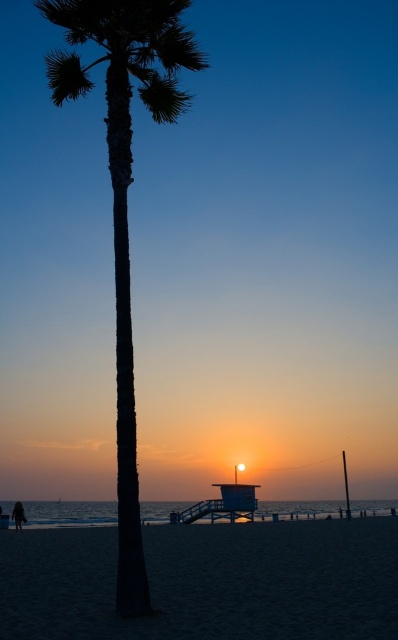
Question: Does sandy beach at lower center have a smaller size compared to dark skin person at lower left?

Choices:
 (A) no
 (B) yes

Answer: (A)

Question: Which point appears closest to the camera in this image?

Choices:
 (A) pos(19,508)
 (B) pos(70,83)

Answer: (B)

Question: Does sandy beach at lower center have a lesser width compared to dark green textured palm tree at center?

Choices:
 (A) yes
 (B) no

Answer: (B)

Question: Which of these objects is positioned farthest from the dark green textured palm tree at center?

Choices:
 (A) dark skin person at lower left
 (B) sandy beach at lower center

Answer: (A)

Question: Which of the following is the farthest from the observer?

Choices:
 (A) (312, 593)
 (B) (21, 502)
 (C) (64, 10)

Answer: (B)

Question: Does dark green textured palm tree at center have a smaller size compared to dark skin person at lower left?

Choices:
 (A) yes
 (B) no

Answer: (B)